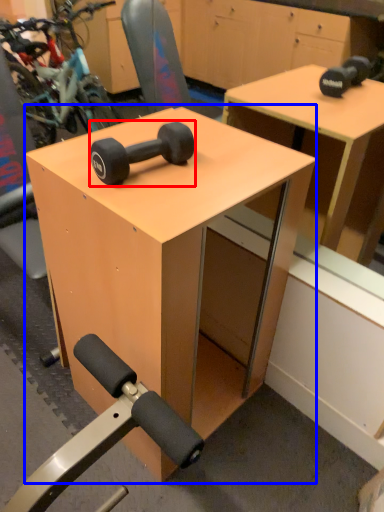
Question: Which point is closer to the camera, dumbbell (highlighted by a red box) or table (highlighted by a blue box)?

Choices:
 (A) dumbbell
 (B) table

Answer: (B)